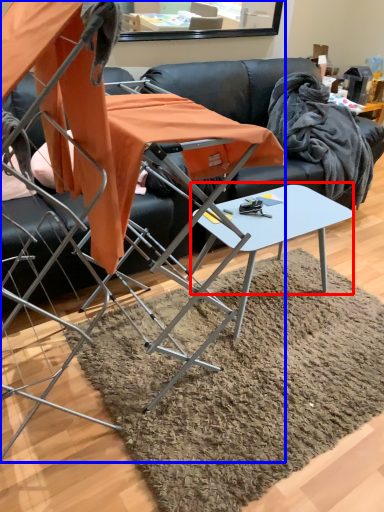
Question: Which object appears farthest to the camera in this image, round table (highlighted by a red box) or chair (highlighted by a blue box)?

Choices:
 (A) round table
 (B) chair

Answer: (A)